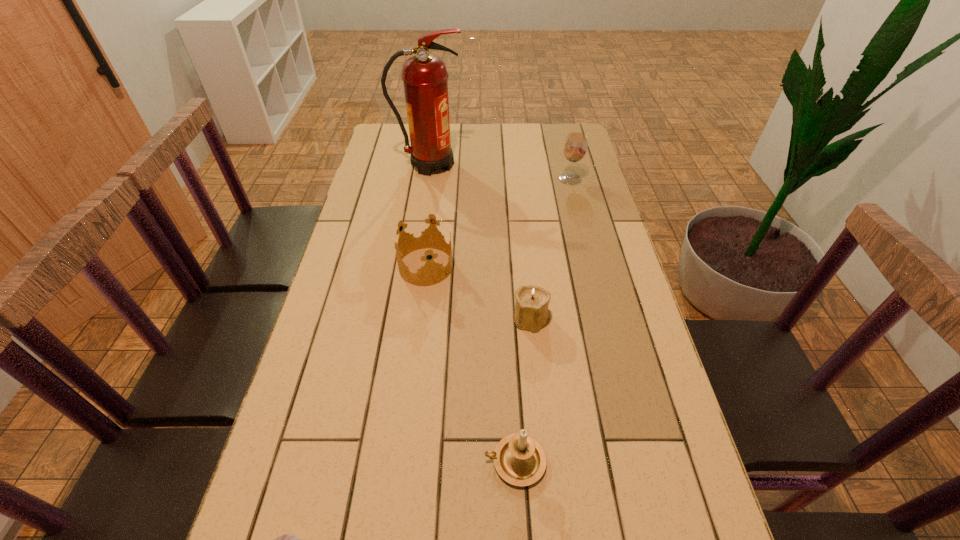
Locate an element on the screen. free space in the image that satisfies the following two spatial constraints: 1. on the back side of the crown; 2. on the front-facing side of the tallest object is located at coordinates (439, 165).

Locate an element on the screen. The height and width of the screenshot is (540, 960). vacant space that satisfies the following two spatial constraints: 1. on the front-facing side of the fire extinguisher; 2. on the right side of the farther candle_holder is located at coordinates (408, 319).

I want to click on free space in the image that satisfies the following two spatial constraints: 1. on the front-facing side of the tallest object; 2. on the right side of the fourth farthest object, so click(408, 319).